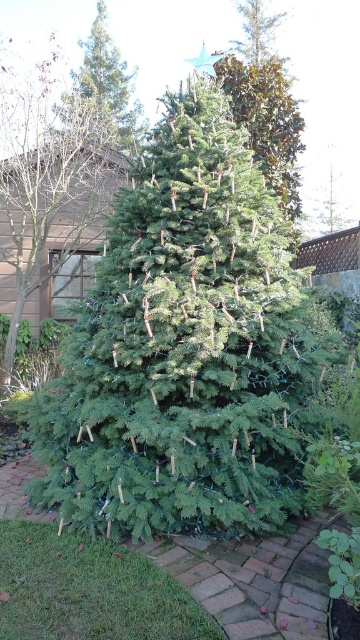
Question: Which is nearer to the green matte tree at center?

Choices:
 (A) green matte christmas tree at center
 (B) green matte tree at upper center

Answer: (B)

Question: Can you confirm if green matte christmas tree at center is positioned below green matte tree at upper center?

Choices:
 (A) yes
 (B) no

Answer: (A)

Question: Among these points, which one is farthest from the camera?

Choices:
 (A) (281, 422)
 (B) (91, 40)
 (C) (128, 97)

Answer: (B)

Question: Which of these objects is positioned farthest from the green matte tree at upper center?

Choices:
 (A) green matte christmas tree at center
 (B) green matte tree at center

Answer: (A)

Question: Considering the relative positions of green matte christmas tree at center and green matte tree at center in the image provided, where is green matte christmas tree at center located with respect to green matte tree at center?

Choices:
 (A) right
 (B) left

Answer: (A)

Question: Is the position of green matte tree at center more distant than that of green matte tree at upper center?

Choices:
 (A) yes
 (B) no

Answer: (B)